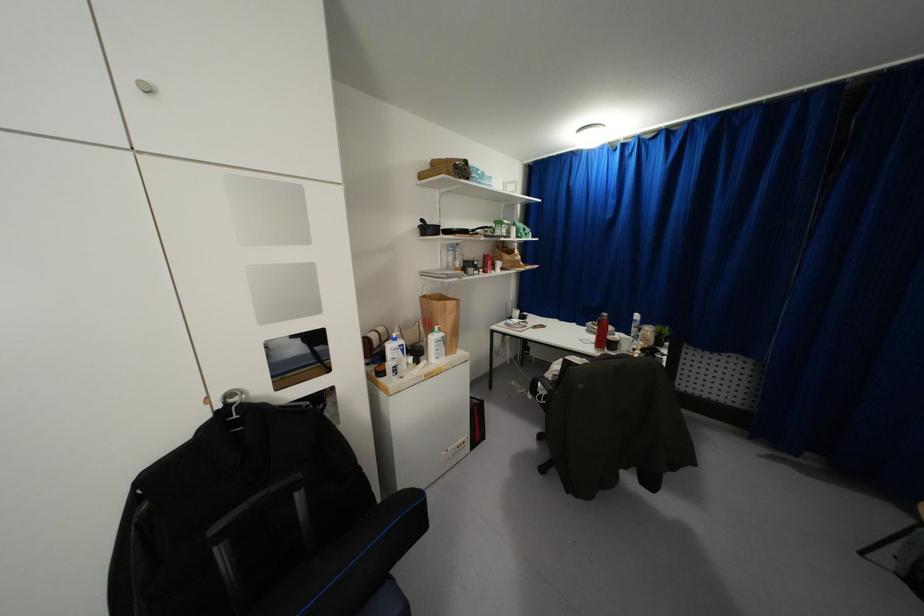
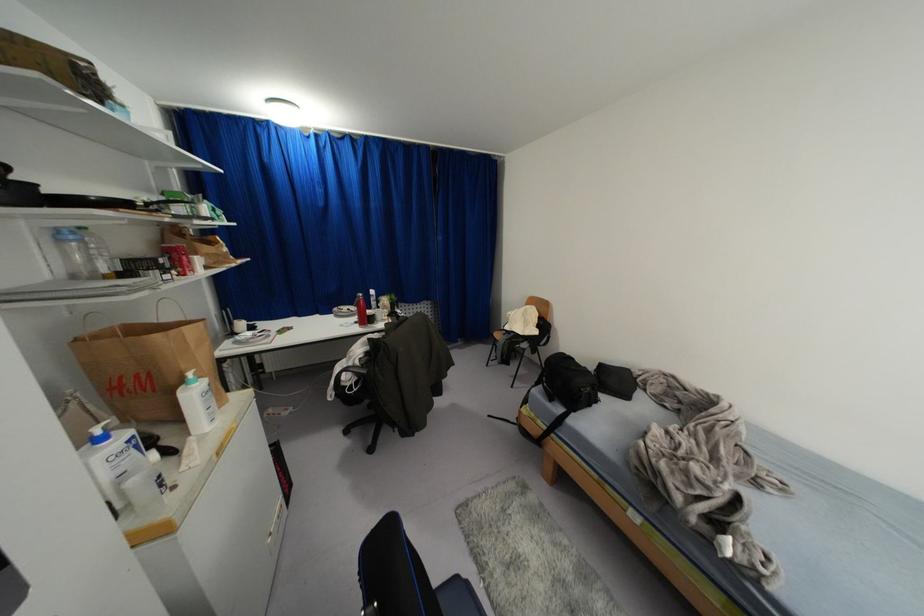
Where in the second image is the point corresponding to (509,317) from the first image?

(234, 333)